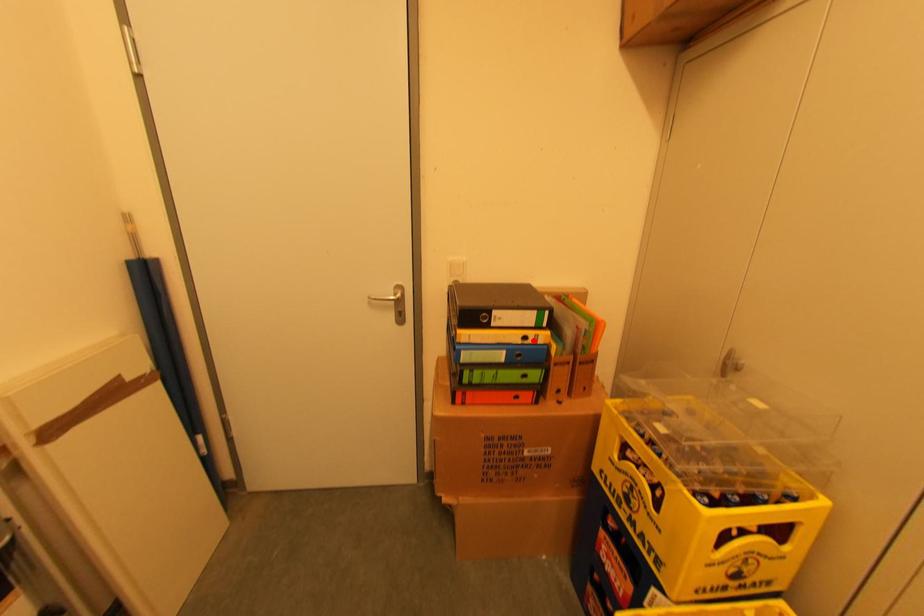
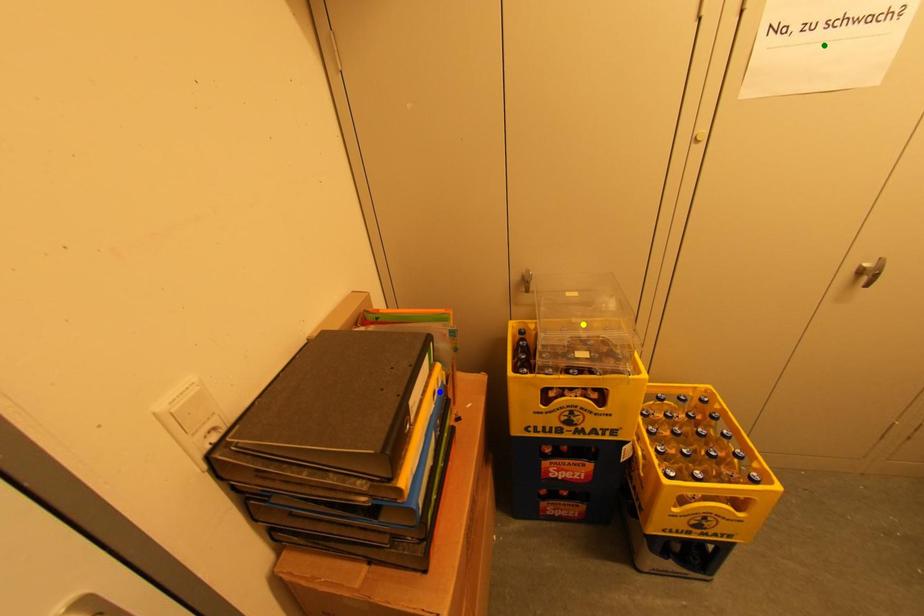
Question: I am providing you with two images of the same scene from different viewpoints. A red point is marked on the first image. You are given multiple points on the second image. In image 2, which mark is for the same physical point as the one in image 1?

Choices:
 (A) green point
 (B) blue point
 (C) yellow point

Answer: (B)